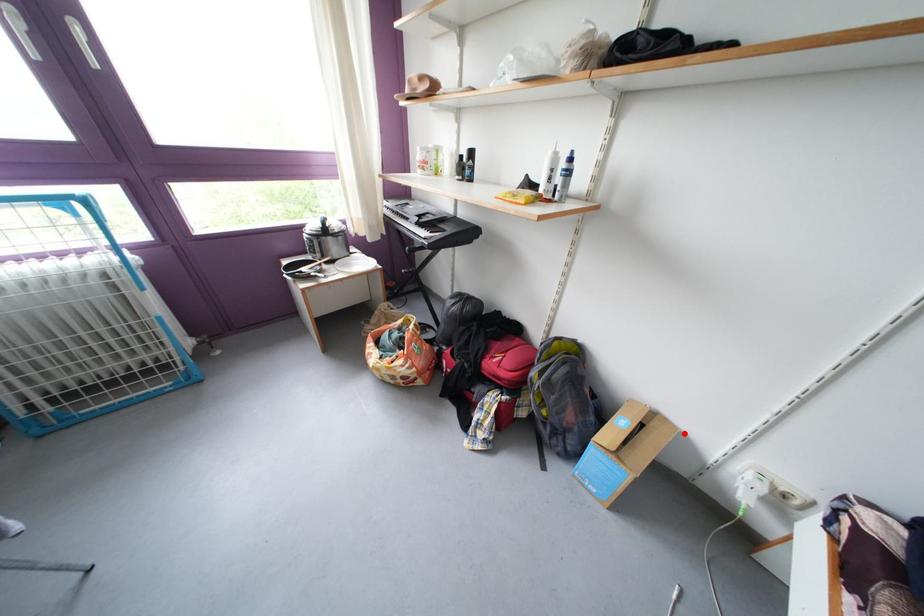
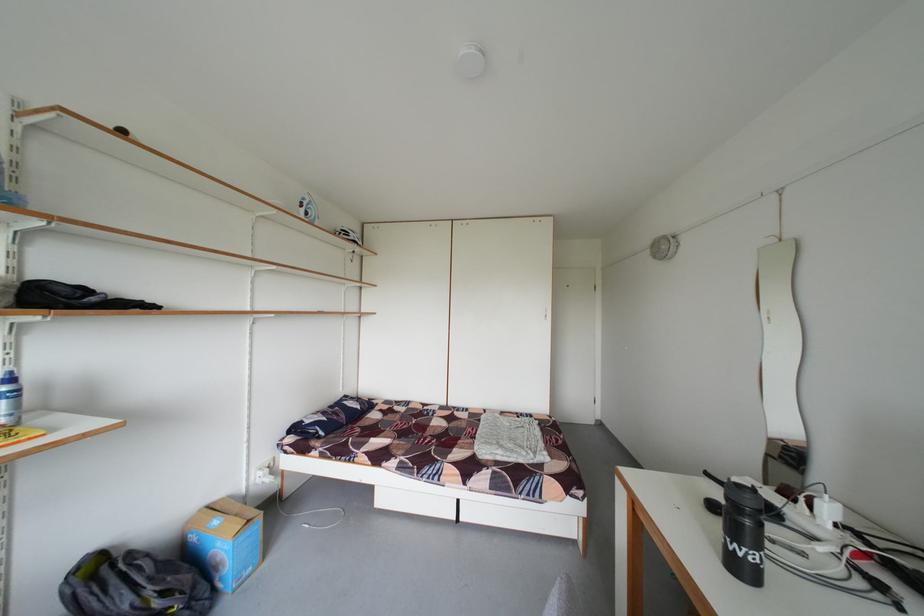
Where in the second image is the point corresponding to the highlighted location from the first image?

(233, 505)